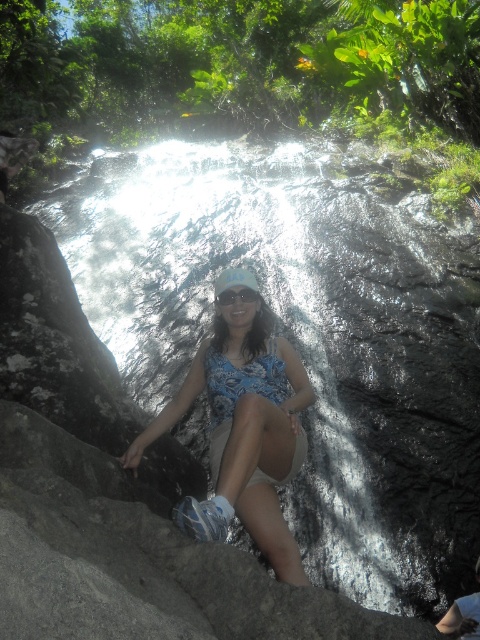
You are a photographer trying to capture the waterfall scene. You notice the clear water at center and the transparent plastic goggles at center. Which object should you focus on first if you want to capture the misty effect created by the waterfall?

The clear water at center is located above the transparent plastic goggles at center. To capture the misty effect, focus on the clear water at center first as it is the source of the mist.

You are a photographer trying to capture the perfect shot of the blue floral dress at center and the transparent plastic goggles at center. To ensure both are in frame, you need to adjust your camera angle. Which object should you focus on first to include both in the shot?

You should focus on the blue floral dress at center first since it is positioned to the left of the transparent plastic goggles at center, allowing you to frame both by adjusting the camera angle from left to right.